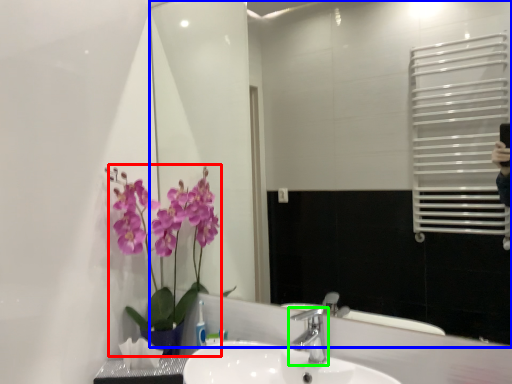
Question: Based on their relative distances, which object is farther from floral arrangement (highlighted by a red box)? Choose from mirror (highlighted by a blue box) and tap (highlighted by a green box).

Choices:
 (A) mirror
 (B) tap

Answer: (A)